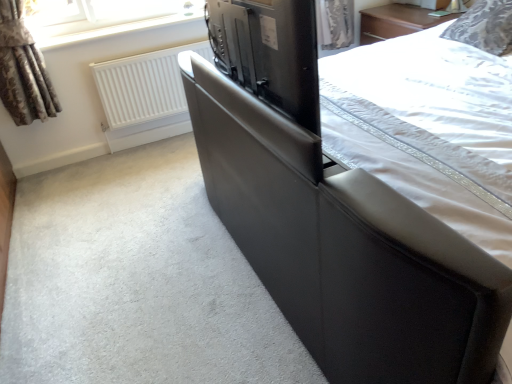
Question: Is white matte radiator at upper left situated inside matte black tv at center or outside?

Choices:
 (A) outside
 (B) inside

Answer: (A)

Question: Considering the positions of white matte radiator at upper left and matte black tv at center in the image, is white matte radiator at upper left taller or shorter than matte black tv at center?

Choices:
 (A) tall
 (B) short

Answer: (A)

Question: Which is nearer to the black leather bed at center?

Choices:
 (A) patterned fabric pillow at upper right
 (B) matte black tv at center
 (C) brown textured curtain at upper left
 (D) white matte radiator at upper left

Answer: (B)

Question: Which of these objects is positioned closest to the brown textured curtain at upper left?

Choices:
 (A) matte black tv at center
 (B) white matte radiator at upper left
 (C) patterned fabric pillow at upper right
 (D) black leather bed at center

Answer: (B)